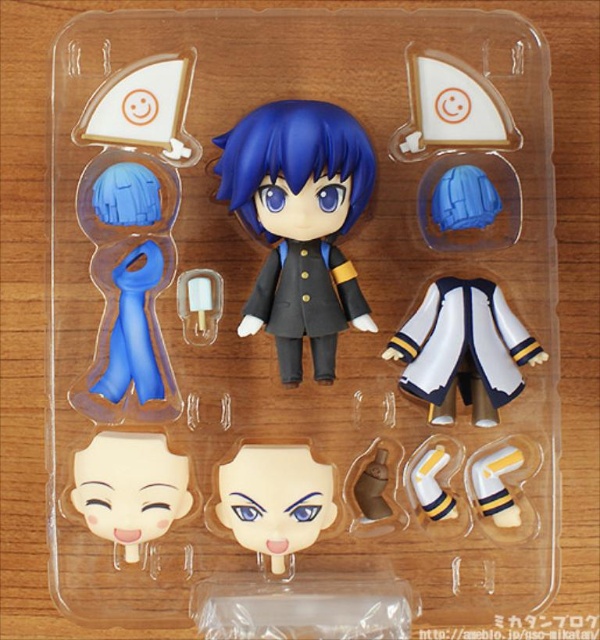
Question: Is matte blue scarf at left closer to the viewer compared to smooth beige face at center?

Choices:
 (A) no
 (B) yes

Answer: (A)

Question: Where is matte blue scarf at left located in relation to white matte jacket at center in the image?

Choices:
 (A) above
 (B) below

Answer: (A)

Question: Which of these objects is positioned farthest from the matte blue scarf at left?

Choices:
 (A) white matte face at center
 (B) smooth beige face at center
 (C) white matte jacket at center
 (D) matte black figure at center

Answer: (C)

Question: Which point is closer to the camera?

Choices:
 (A) (231, 508)
 (B) (298, 243)
 (C) (451, 284)

Answer: (A)

Question: Which point is closer to the camera?

Choices:
 (A) white matte jacket at center
 (B) white matte face at center
 (C) matte blue scarf at left
 (D) matte black figure at center

Answer: (D)

Question: Is white matte jacket at center above white matte face at center?

Choices:
 (A) yes
 (B) no

Answer: (A)